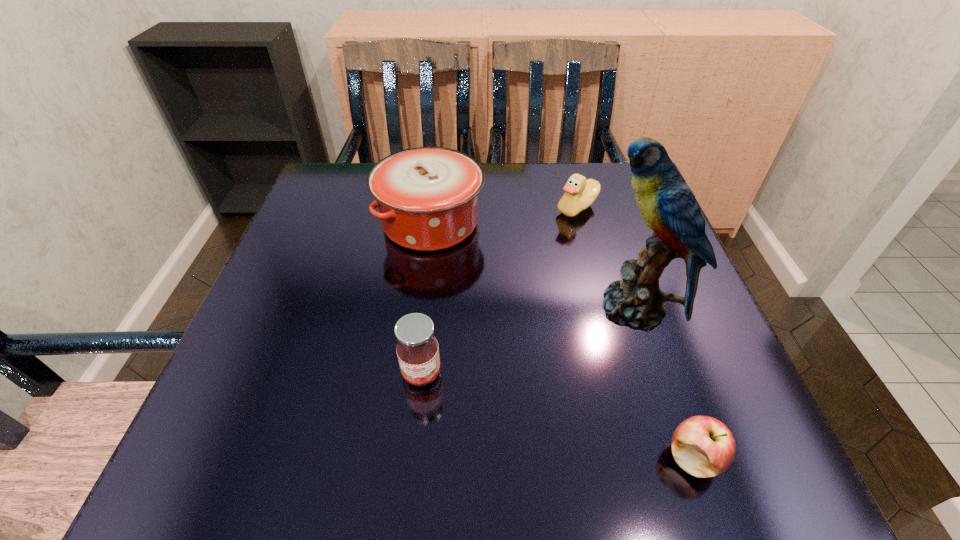
Identify the location of vacant space at the near right corner of the desktop. (741, 483).

Where is `empty space between the second shortest object and the fourth shortest object`? empty space between the second shortest object and the fourth shortest object is located at coordinates (504, 215).

Where is `free area in between the shortest object and the second shortest object`? The image size is (960, 540). free area in between the shortest object and the second shortest object is located at coordinates (636, 333).

At what (x,y) coordinates should I click in order to perform the action: click on vacant area that lies between the parrot and the casserole. Please return your answer as a coordinate pair (x, y). Image resolution: width=960 pixels, height=540 pixels. Looking at the image, I should click on (x=532, y=266).

Where is `empty space between the casserole and the nearest object`? Image resolution: width=960 pixels, height=540 pixels. empty space between the casserole and the nearest object is located at coordinates (x=562, y=341).

Find the location of a particular element. The width and height of the screenshot is (960, 540). free space between the nearest object and the third shortest object is located at coordinates (558, 415).

Identify the location of vacant region between the jam and the shortest object. 558,415.

Where is `vacant space that's between the fourth farthest object and the third nearest object`? vacant space that's between the fourth farthest object and the third nearest object is located at coordinates pyautogui.click(x=528, y=341).

Where is `vacant point located between the parrot and the second tallest object`? This screenshot has width=960, height=540. vacant point located between the parrot and the second tallest object is located at coordinates (532, 266).

The width and height of the screenshot is (960, 540). I want to click on vacant space in between the fourth shortest object and the parrot, so [x=532, y=266].